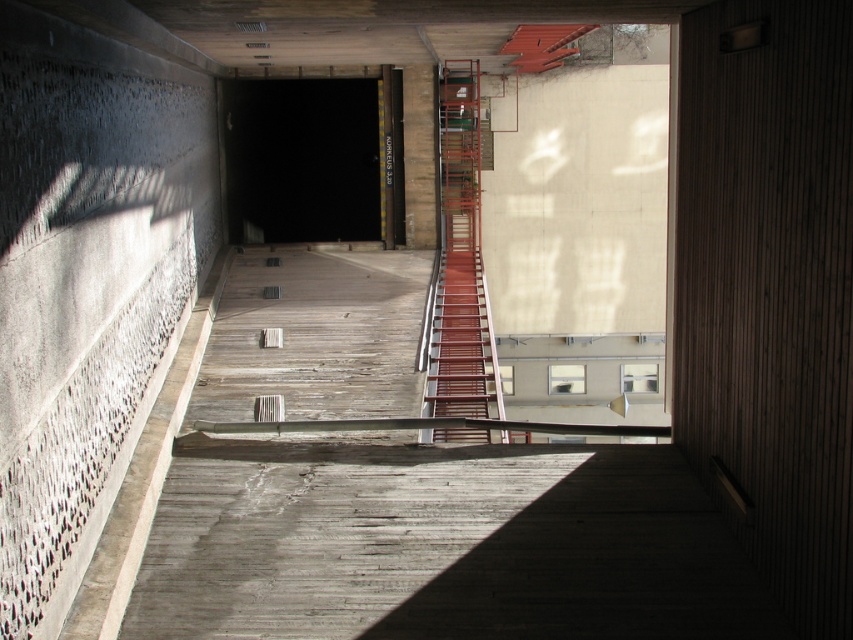
You are a maintenance worker needing to access the black matte tunnel at center and the metallic red staircase at center. Which one requires more space to maneuver around?

The metallic red staircase at center requires more space to maneuver around because it occupies more space than the black matte tunnel at center.

You are a maintenance worker needing to access the top of the structure. You see the black matte tunnel at center and the metallic red staircase at center. Which one allows you to reach a higher point?

The metallic red staircase at center has a greater height than the black matte tunnel at center, so you can reach a higher point by using the metallic red staircase at center.

You are a delivery person carrying a package that requires a clear path 7 meters long to maneuver safely. You see the black matte tunnel at center and the metallic red staircase at center. Can you safely navigate your path between them?

The black matte tunnel at center and the metallic red staircase at center are 6.64 meters apart from each other. Since the required clear path is 7 meters, the distance is insufficient, so you cannot safely navigate between them.